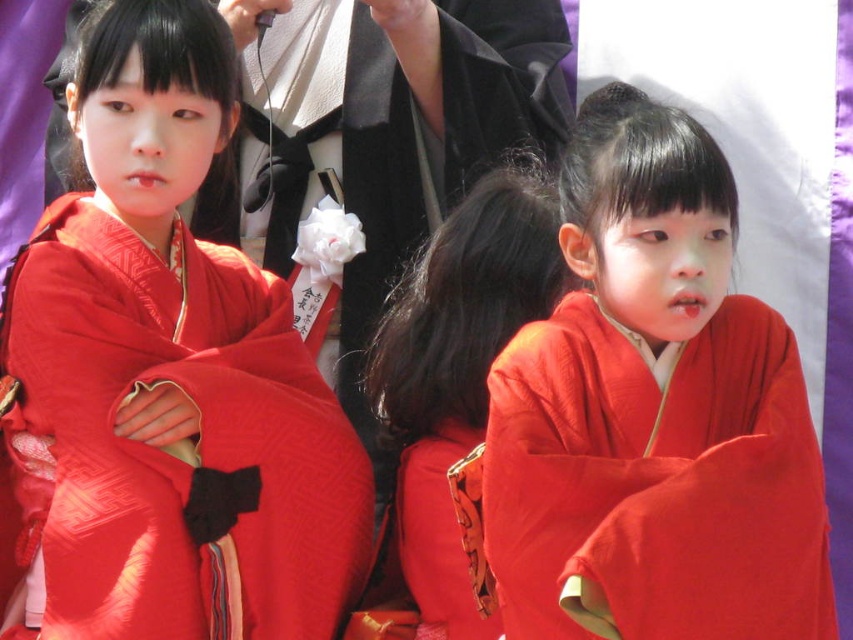
Question: Which of the following is the farthest from the observer?

Choices:
 (A) (474, 625)
 (B) (48, 205)

Answer: (B)

Question: Can you confirm if matte kimono at center is positioned below silky red kimono at center?

Choices:
 (A) yes
 (B) no

Answer: (B)

Question: Does matte kimono at center have a larger size compared to silky red kimono at center?

Choices:
 (A) no
 (B) yes

Answer: (B)

Question: Among these objects, which one is farthest from the camera?

Choices:
 (A) matte kimono at center
 (B) silky red kimono at center
 (C) matte red kimono at center

Answer: (A)

Question: Is matte kimono at center wider than silky red kimono at center?

Choices:
 (A) yes
 (B) no

Answer: (A)

Question: Among these points, which one is nearest to the camera?

Choices:
 (A) (146, 536)
 (B) (662, 470)

Answer: (B)